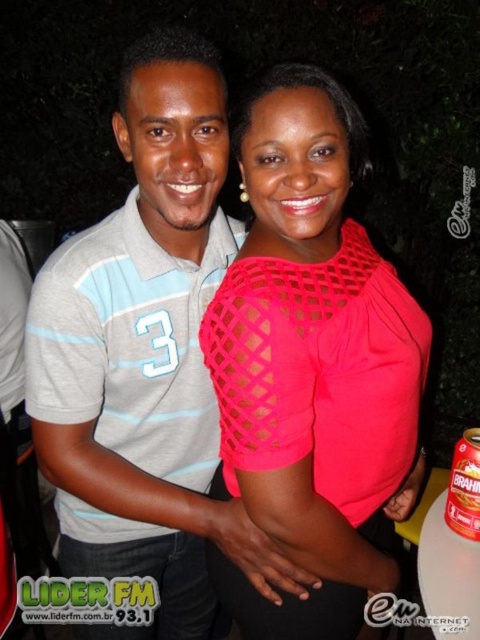
Is bright pink mesh top at center shorter than gray striped polo shirt at center?

Yes.

Can you confirm if bright pink mesh top at center is positioned below gray striped polo shirt at center?

Actually, bright pink mesh top at center is above gray striped polo shirt at center.

At what (x,y) coordinates should I click in order to perform the action: click on bright pink mesh top at center. Please return your answer as a coordinate pair (x, y). This screenshot has height=640, width=480. Looking at the image, I should click on (313, 364).

Can you confirm if bright pink mesh top at center is thinner than brown cardboard can at lower right?

In fact, bright pink mesh top at center might be wider than brown cardboard can at lower right.

Does point (315, 477) come closer to viewer compared to point (476, 499)?

That is True.

Between point (356, 456) and point (457, 512), which one is positioned behind?

The point (457, 512) is behind.

The height and width of the screenshot is (640, 480). I want to click on bright pink mesh top at center, so click(313, 364).

Which is more to the right, gray striped polo shirt at center or brown cardboard can at lower right?

brown cardboard can at lower right is more to the right.

Between point (95, 225) and point (465, 445), which one is positioned in front?

Point (465, 445) is in front.

Is point (197, 556) positioned after point (475, 467)?

That is True.

You are a GUI agent. You are given a task and a screenshot of the screen. Output one action in this format:
    pyautogui.click(x=<x>, y=<y>)
    Task: Click on the gray striped polo shirt at center
    
    Given the screenshot: What is the action you would take?
    pyautogui.click(x=141, y=348)